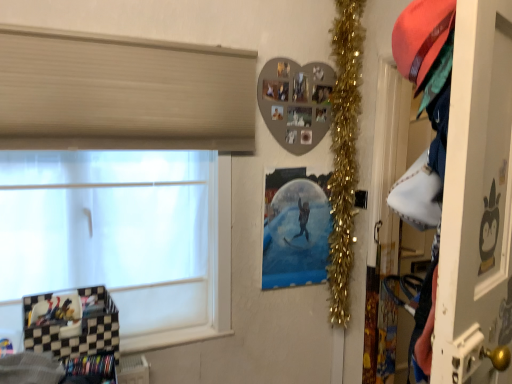
Question: Considering the relative sizes of gold tinsel garland at upper right and white matte window at left in the image provided, is gold tinsel garland at upper right smaller than white matte window at left?

Choices:
 (A) yes
 (B) no

Answer: (A)

Question: Would you say gold tinsel garland at upper right contains white matte window at left?

Choices:
 (A) no
 (B) yes

Answer: (A)

Question: Does gold tinsel garland at upper right come in front of white matte window at left?

Choices:
 (A) yes
 (B) no

Answer: (B)

Question: Can you confirm if gold tinsel garland at upper right is bigger than white matte window at left?

Choices:
 (A) yes
 (B) no

Answer: (B)

Question: Is gold tinsel garland at upper right further to camera compared to white matte window at left?

Choices:
 (A) yes
 (B) no

Answer: (A)

Question: From a real-world perspective, is white matte window at left physically located above or below gold tinsel garland at upper right?

Choices:
 (A) below
 (B) above

Answer: (A)

Question: From their relative heights in the image, would you say white matte window at left is taller or shorter than gold tinsel garland at upper right?

Choices:
 (A) short
 (B) tall

Answer: (A)

Question: In the image, is white matte window at left on the left side or the right side of gold tinsel garland at upper right?

Choices:
 (A) left
 (B) right

Answer: (A)

Question: Is white matte window at left situated inside gold tinsel garland at upper right or outside?

Choices:
 (A) outside
 (B) inside

Answer: (A)

Question: In terms of height, does metallic silver poster at center look taller or shorter compared to white matte window at left?

Choices:
 (A) short
 (B) tall

Answer: (A)

Question: From a real-world perspective, is metallic silver poster at center above or below white matte window at left?

Choices:
 (A) above
 (B) below

Answer: (B)

Question: Based on their sizes in the image, would you say metallic silver poster at center is bigger or smaller than white matte window at left?

Choices:
 (A) big
 (B) small

Answer: (B)

Question: Would you say metallic silver poster at center is inside or outside white matte window at left?

Choices:
 (A) outside
 (B) inside

Answer: (A)

Question: Is metallic silver poster at center wider or thinner than white glossy screen door at right?

Choices:
 (A) thin
 (B) wide

Answer: (A)

Question: From the image's perspective, relative to white glossy screen door at right, is metallic silver poster at center above or below?

Choices:
 (A) above
 (B) below

Answer: (B)